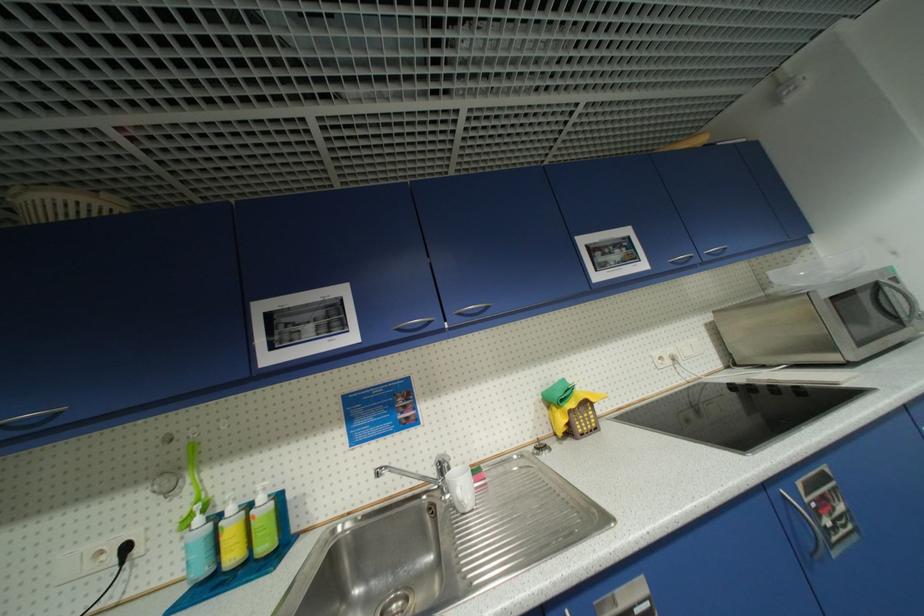
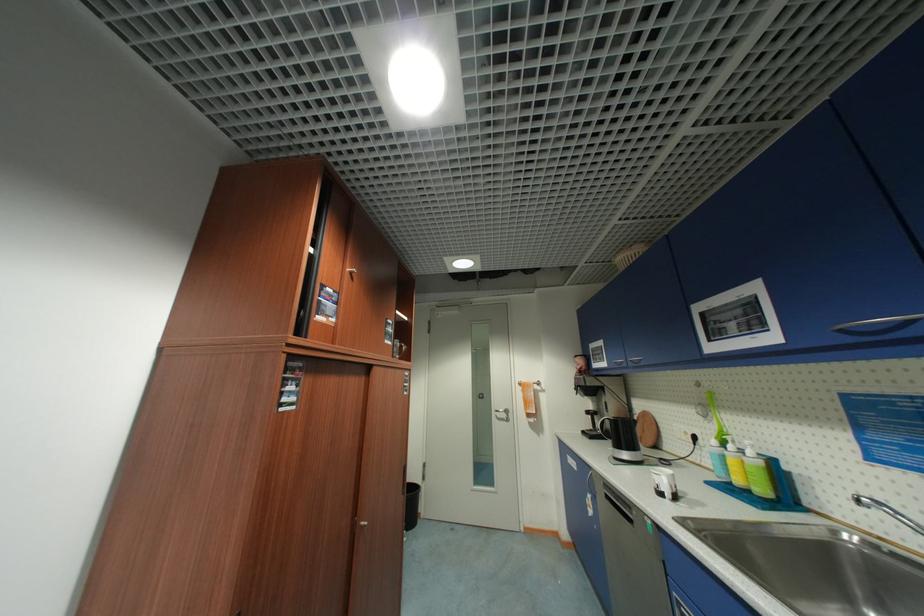
Find the pixel in the second image that matches pixel 266 500 in the first image.

(756, 454)